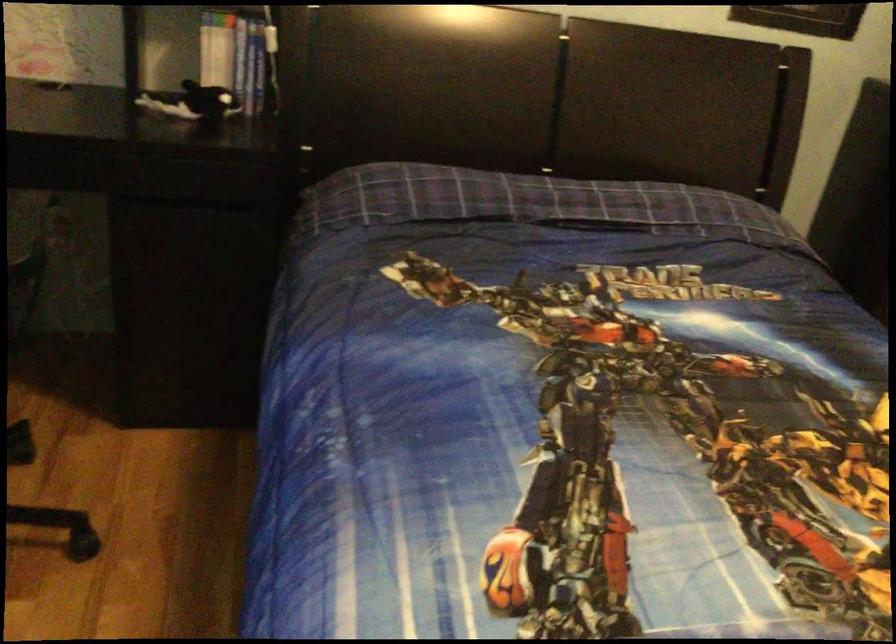
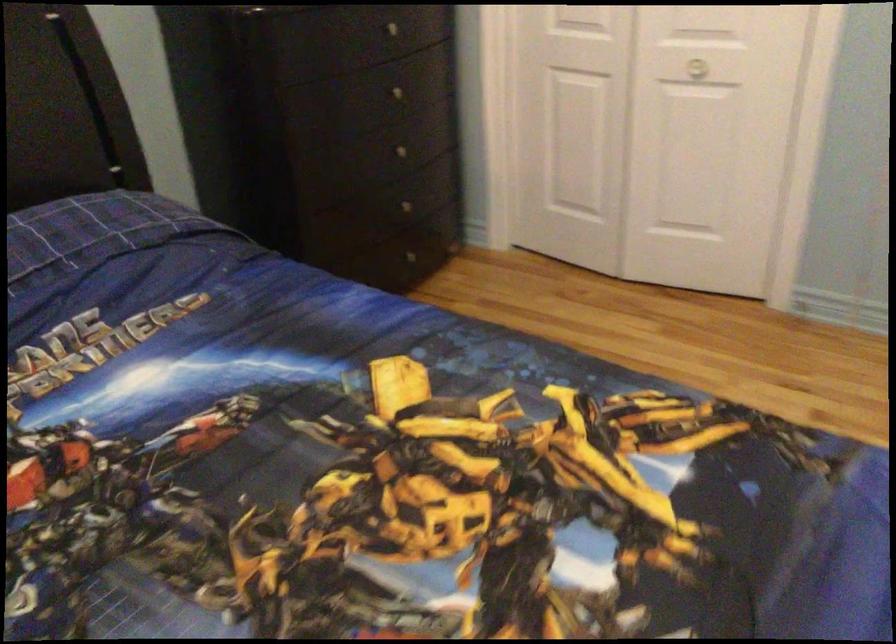
Question: The camera is either moving clockwise (left) or counter-clockwise (right) around the object. The first image is from the beginning of the video and the second image is from the end. Is the camera moving left or right when shooting the video?

Choices:
 (A) Left
 (B) Right

Answer: (A)